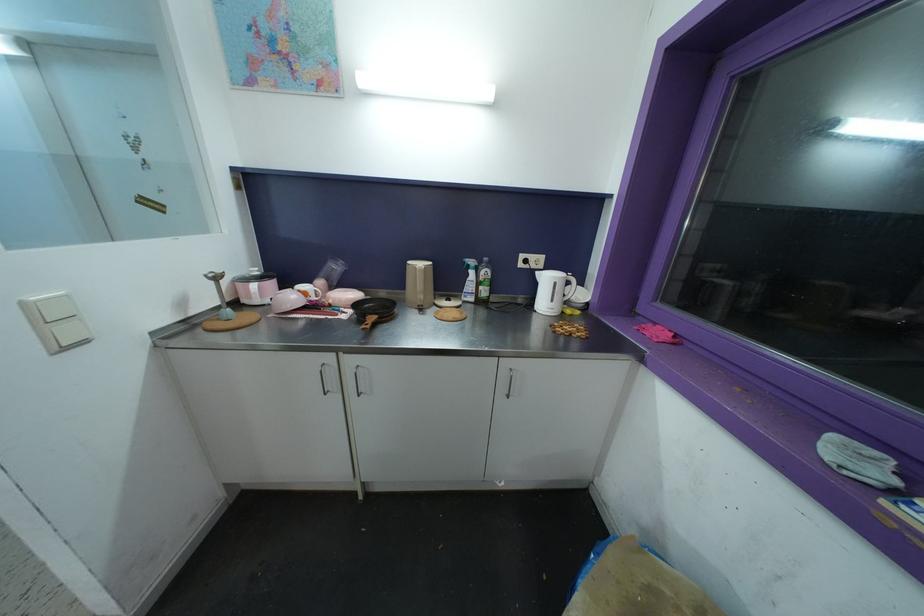
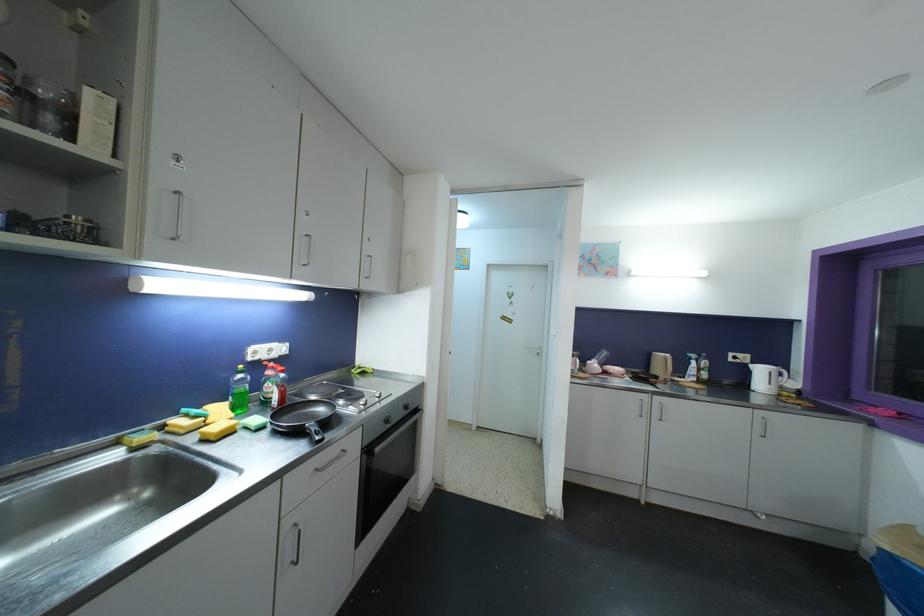
Where in the second image is the point corresponding to (525,259) from the first image?

(734, 357)